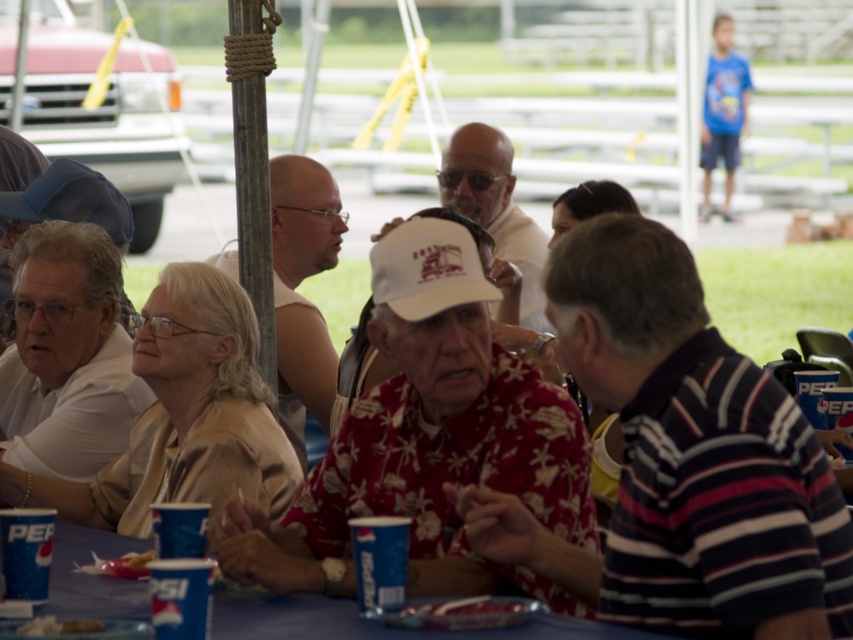
Can you confirm if blue paper cups at lower center is shorter than white paper plate at lower center?

Incorrect, blue paper cups at lower center's height does not fall short of white paper plate at lower center's.

Is blue paper cups at lower center closer to the viewer compared to white paper plate at lower center?

No, it is behind white paper plate at lower center.

Where is `blue paper cups at lower center`? The image size is (853, 640). blue paper cups at lower center is located at coordinates (373, 621).

The width and height of the screenshot is (853, 640). I want to click on blue paper cups at lower center, so click(x=373, y=621).